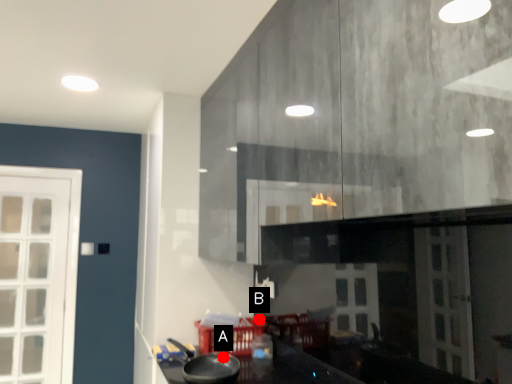
Question: Two points are circled on the image, labeled by A and B beside each circle. Which point appears closest to the camera in this image?

Choices:
 (A) A is closer
 (B) B is closer

Answer: (A)